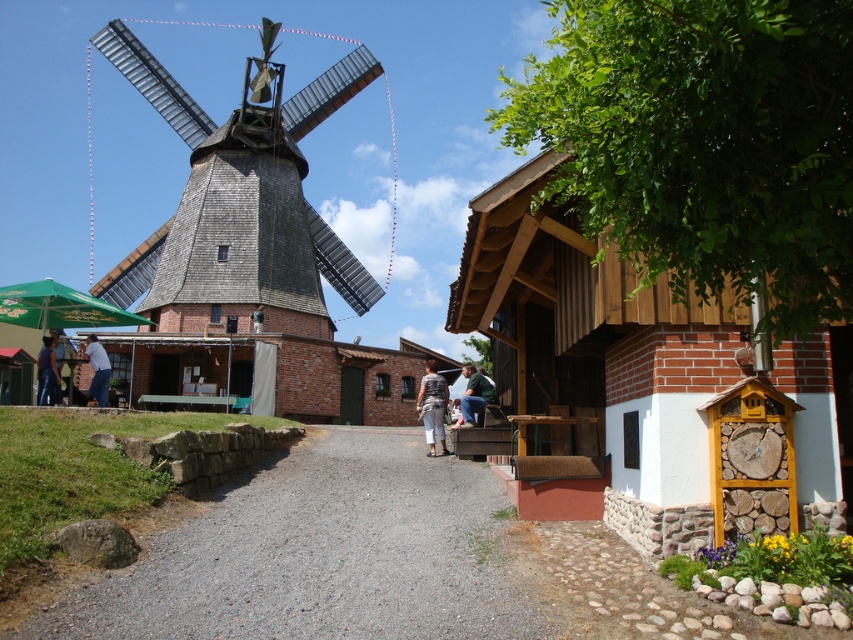
Between wooden shingles windmill at left and green painted wood picnic table at center, which one is positioned higher?

wooden shingles windmill at left

Does point (96, 292) come closer to viewer compared to point (157, 397)?

No, (96, 292) is behind (157, 397).

Where is `wooden shingles windmill at left`? wooden shingles windmill at left is located at coordinates 154,83.

Between gray gravel path at center and white shirt at center, which one is positioned lower?

gray gravel path at center

Based on the photo, measure the distance between point (x=227, y=595) and camera.

Point (x=227, y=595) and camera are 32.73 feet apart from each other.

The width and height of the screenshot is (853, 640). I want to click on gray gravel path at center, so click(x=320, y=556).

Is point (463, 419) behind point (51, 342)?

No.

I want to click on green fabric jacket at center, so click(x=473, y=396).